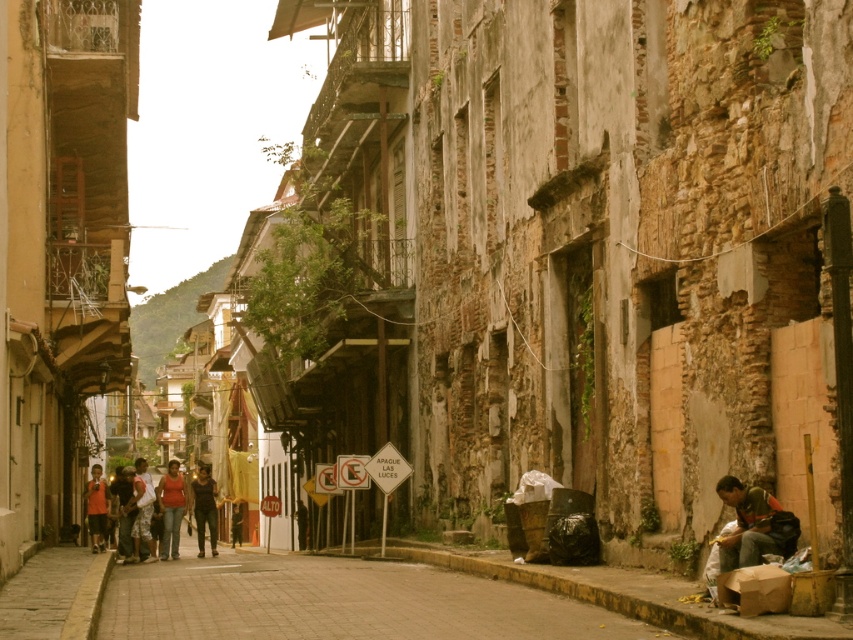
Question: Can you confirm if matte red shirt at center is positioned below dark blue jeans at center?

Choices:
 (A) yes
 (B) no

Answer: (A)

Question: Does dark brown leather jacket at center appear on the left side of orange fabric shirt at lower left?

Choices:
 (A) no
 (B) yes

Answer: (B)

Question: Is dark brown leather jacket at center positioned before dark blue jeans at center?

Choices:
 (A) yes
 (B) no

Answer: (B)

Question: Estimate the real-world distances between objects in this image. Which object is closer to the dark brown leather jacket at center?

Choices:
 (A) green fabric bag at lower right
 (B) orange fabric shirt at lower left
 (C) matte black shirt at center
 (D) brown brick pavement at center

Answer: (C)

Question: Which of the following is the closest to the observer?

Choices:
 (A) orange fabric shirt at lower left
 (B) dark brown leather jacket at center
 (C) dark blue jeans at center

Answer: (A)

Question: Considering the real-world distances, which object is closest to the matte red shirt at center?

Choices:
 (A) green fabric bag at lower right
 (B) orange fabric shirt at lower left
 (C) dark brown leather jacket at center

Answer: (B)